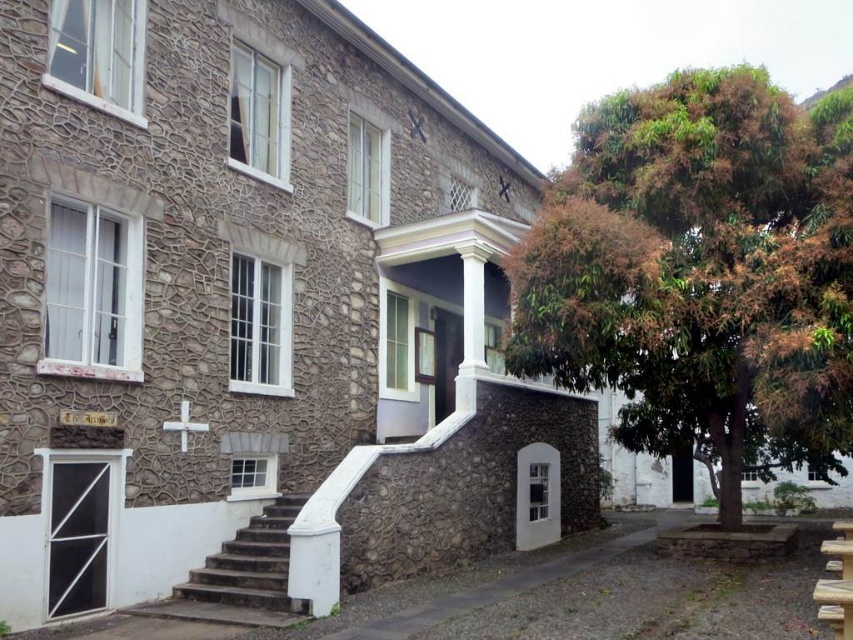
Question: Can you confirm if brown leafy tree at right is positioned to the right of white stone stairs at lower left?

Choices:
 (A) no
 (B) yes

Answer: (B)

Question: Which point is closer to the camera?

Choices:
 (A) white stone stairs at lower left
 (B) brown leafy tree at right

Answer: (A)

Question: From the image, what is the correct spatial relationship of brown leafy tree at right in relation to white stone stairs at lower left?

Choices:
 (A) below
 (B) above

Answer: (B)

Question: Does brown leafy tree at right lie behind white stone stairs at lower left?

Choices:
 (A) no
 (B) yes

Answer: (B)

Question: Which object appears closest to the camera in this image?

Choices:
 (A) brown leafy tree at right
 (B) white stone stairs at lower left

Answer: (B)